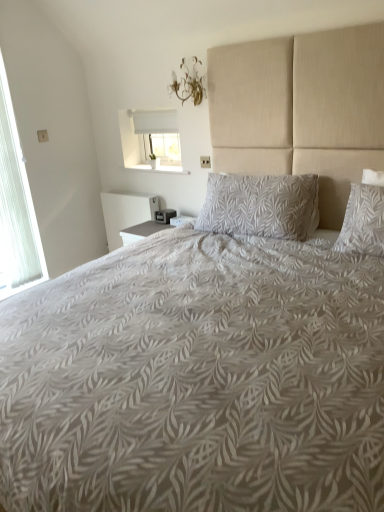
Question: From a real-world perspective, does white sheer curtain at left, which appears as the first window when viewed from the left, sit lower than gold metallic chandelier at upper center?

Choices:
 (A) no
 (B) yes

Answer: (B)

Question: Does white sheer curtain at left, which is the 2th window in right-to-left order, have a larger size compared to gold metallic chandelier at upper center?

Choices:
 (A) yes
 (B) no

Answer: (A)

Question: Does white sheer curtain at left, which is the 2th window in right-to-left order, turn towards gold metallic chandelier at upper center?

Choices:
 (A) yes
 (B) no

Answer: (B)

Question: Is white sheer curtain at left, which is the 2th window in right-to-left order, surrounding gold metallic chandelier at upper center?

Choices:
 (A) no
 (B) yes

Answer: (A)

Question: Considering the relative sizes of white sheer curtain at left, which is the 2th window in right-to-left order, and gold metallic chandelier at upper center in the image provided, is white sheer curtain at left, which is the 2th window in right-to-left order, smaller than gold metallic chandelier at upper center?

Choices:
 (A) yes
 (B) no

Answer: (B)

Question: Can we say white sheer curtain at left, which appears as the first window when viewed from the left, lies outside gold metallic chandelier at upper center?

Choices:
 (A) no
 (B) yes

Answer: (B)

Question: Can you confirm if gold metallic chandelier at upper center is taller than gray leaf-patterned pillow at center?

Choices:
 (A) yes
 (B) no

Answer: (B)

Question: Could you tell me if gold metallic chandelier at upper center is turned towards gray leaf-patterned pillow at center?

Choices:
 (A) no
 (B) yes

Answer: (A)

Question: Is gold metallic chandelier at upper center with gray leaf-patterned pillow at center?

Choices:
 (A) no
 (B) yes

Answer: (A)

Question: Can you confirm if gold metallic chandelier at upper center is bigger than gray leaf-patterned pillow at center?

Choices:
 (A) yes
 (B) no

Answer: (B)

Question: Can you confirm if gold metallic chandelier at upper center is shorter than gray leaf-patterned pillow at center?

Choices:
 (A) no
 (B) yes

Answer: (B)

Question: Considering the relative positions of gold metallic chandelier at upper center and gray leaf-patterned pillow at center in the image provided, is gold metallic chandelier at upper center to the left of gray leaf-patterned pillow at center from the viewer's perspective?

Choices:
 (A) no
 (B) yes

Answer: (B)

Question: Is the depth of white fabric window at upper center, placed as the 2th window when sorted from left to right, less than that of gray leaf-patterned pillow at center?

Choices:
 (A) no
 (B) yes

Answer: (A)